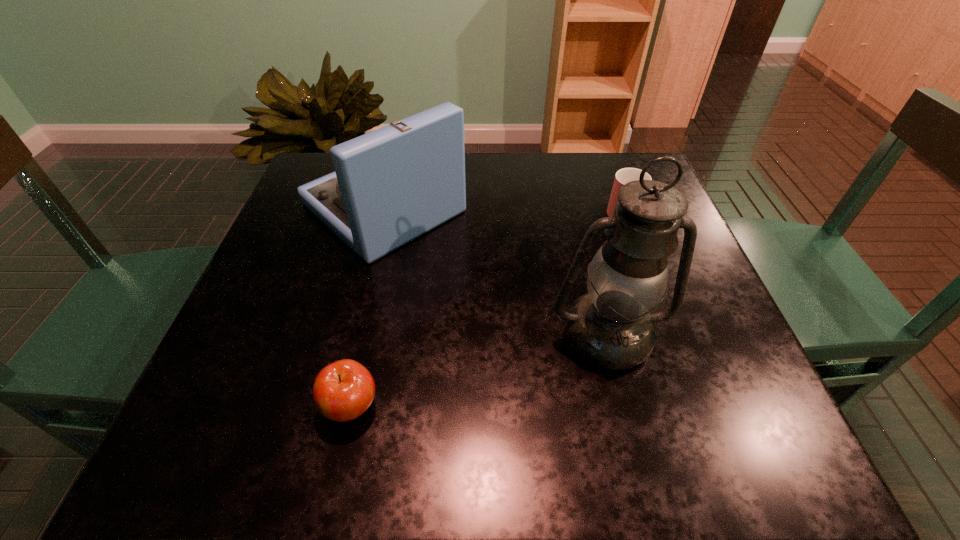
Find the location of `free space between the nearest object and the tallest object`. free space between the nearest object and the tallest object is located at coordinates (479, 370).

The width and height of the screenshot is (960, 540). Identify the location of free space between the third shortest object and the cup. (503, 208).

Identify the location of vacant space that's between the phonograph record and the apple. (368, 307).

The image size is (960, 540). What are the coordinates of `the second closest object to the phonograph record` in the screenshot? It's located at [x=343, y=390].

Image resolution: width=960 pixels, height=540 pixels. Identify the location of object that is the second closest one to the cup. (390, 186).

At what (x,y) coordinates should I click in order to perform the action: click on vacant position in the image that satisfies the following two spatial constraints: 1. on the back side of the second nearest object; 2. on the right side of the apple. Please return your answer as a coordinate pair (x, y). This screenshot has height=540, width=960. Looking at the image, I should click on (367, 335).